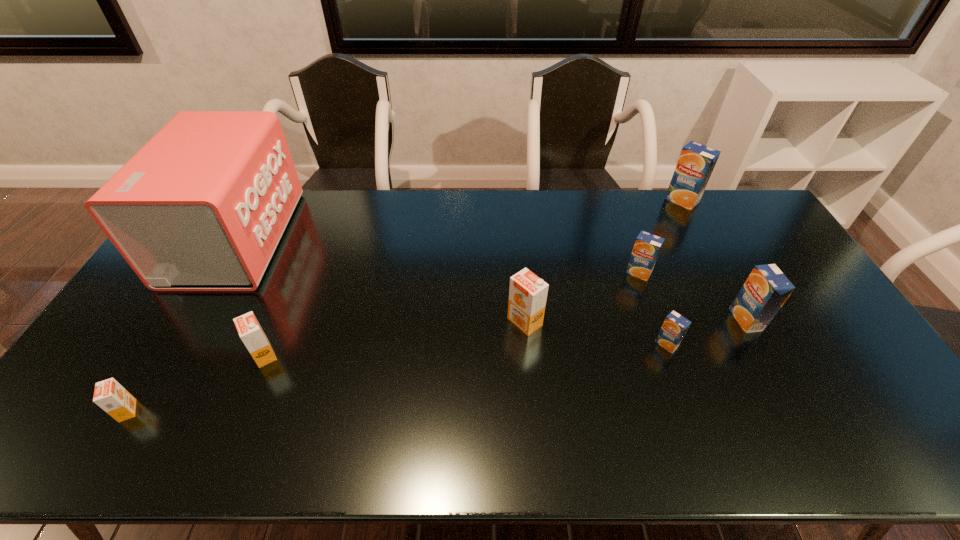
Where is `vacant space positioned on the right of the smallest blue orange_juice`? vacant space positioned on the right of the smallest blue orange_juice is located at coordinates (783, 344).

Locate an element on the screen. This screenshot has width=960, height=540. free location located on the back of the nearest object is located at coordinates (191, 305).

Find the location of a particular element. This screenshot has width=960, height=540. box present at the far edge is located at coordinates (202, 206).

At what (x,y) coordinates should I click in order to perform the action: click on orange_juice that is at the far edge. Please return your answer as a coordinate pair (x, y). The image size is (960, 540). Looking at the image, I should click on 696,162.

Where is `box that is positioned at the left edge`? This screenshot has width=960, height=540. box that is positioned at the left edge is located at coordinates (202, 206).

Where is `orange juice situated at the left edge`? This screenshot has height=540, width=960. orange juice situated at the left edge is located at coordinates (114, 399).

Find the location of a particular element. object that is at the far left corner is located at coordinates (202, 206).

The width and height of the screenshot is (960, 540). Identify the location of vacant space at the far edge. (440, 197).

The image size is (960, 540). In order to click on vacant point at the near edge in this screenshot , I will do `click(180, 451)`.

This screenshot has width=960, height=540. What are the coordinates of `free space between the fifth object from right to left and the second orange orange juice from right to left` in the screenshot? It's located at (395, 339).